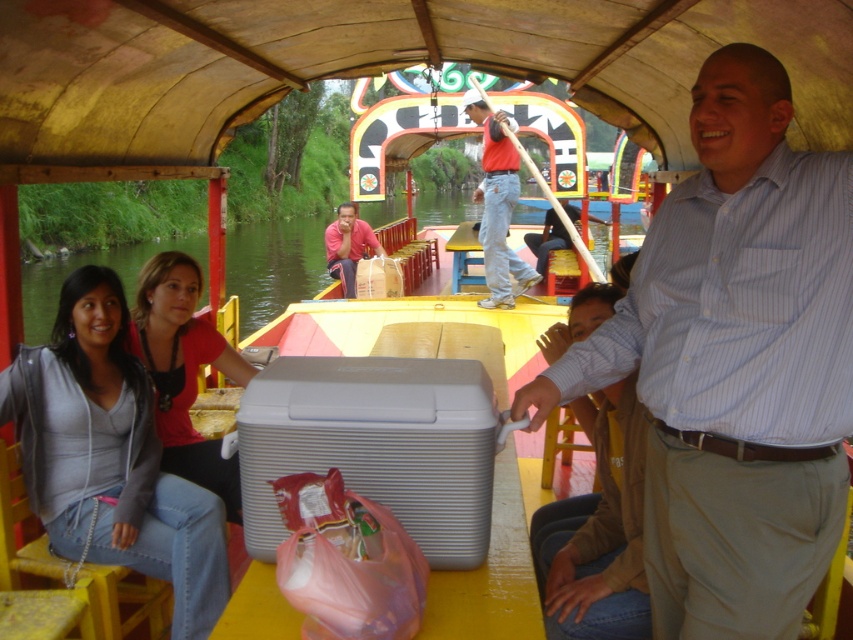
Question: Is pink plastic bag at center positioned in front of matte red shirt at center?

Choices:
 (A) yes
 (B) no

Answer: (A)

Question: Which point is farther from the camera taking this photo?

Choices:
 (A) (329, 616)
 (B) (276, 442)

Answer: (B)

Question: Is pink plastic bag at center to the left of green water at center from the viewer's perspective?

Choices:
 (A) yes
 (B) no

Answer: (B)

Question: Which of these objects is positioned closest to the matte gray jacket at lower left?

Choices:
 (A) matte blue shirt at center
 (B) striped cotton shirt at center
 (C) green water at center
 (D) gray ribbed cooler at center

Answer: (D)

Question: Is matte red shirt at center bigger than matte pink shirt at center?

Choices:
 (A) no
 (B) yes

Answer: (B)

Question: Which of the following is the farthest from the observer?

Choices:
 (A) coord(303,566)
 (B) coord(457,544)
 (C) coord(138,560)

Answer: (C)